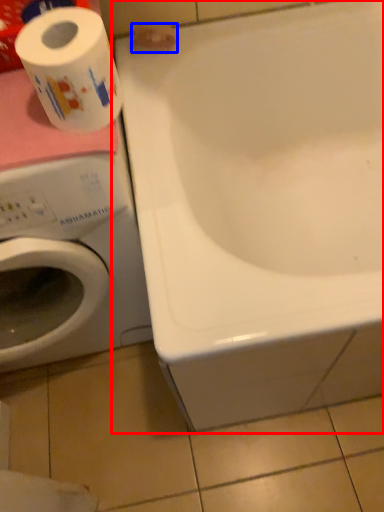
Question: Which object appears farthest to the camera in this image, bathtub (highlighted by a red box) or toilet paper (highlighted by a blue box)?

Choices:
 (A) bathtub
 (B) toilet paper

Answer: (B)